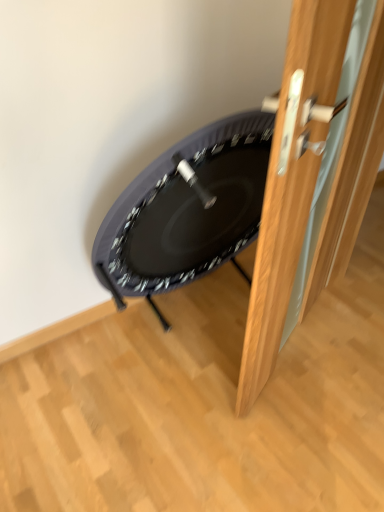
This screenshot has width=384, height=512. In order to click on free space below wooden door at right (from a real-world perspective) in this screenshot , I will do `click(286, 352)`.